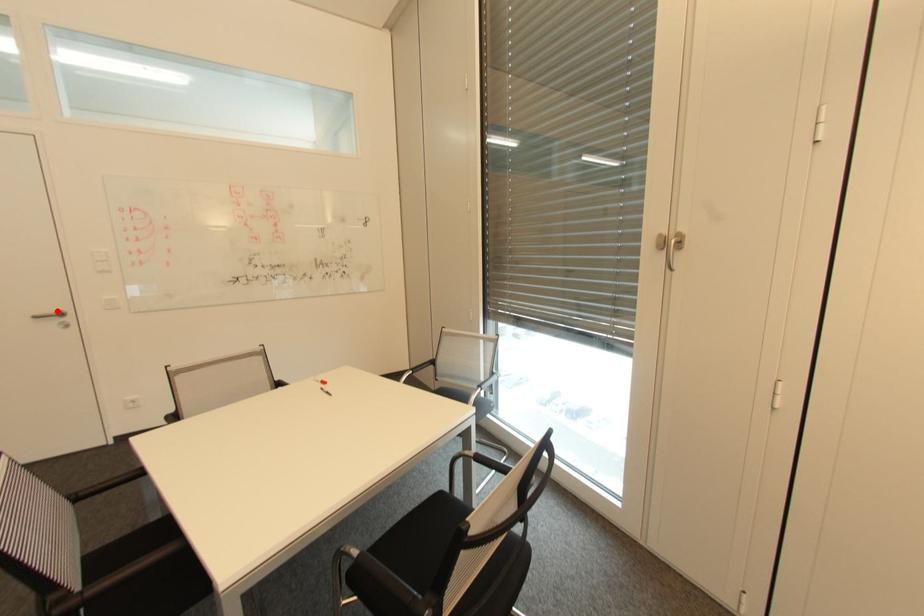
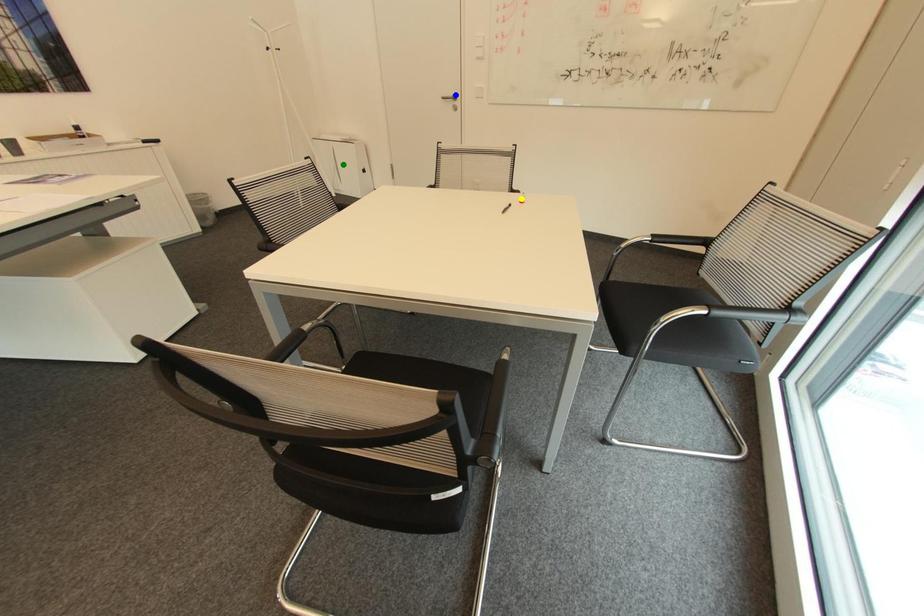
Question: I am providing you with two images of the same scene from different viewpoints. A red point is marked on the first image. You are given multiple points on the second image. Can you choose the point in image 2 that corresponds to the point in image 1?

Choices:
 (A) green point
 (B) yellow point
 (C) blue point

Answer: (C)